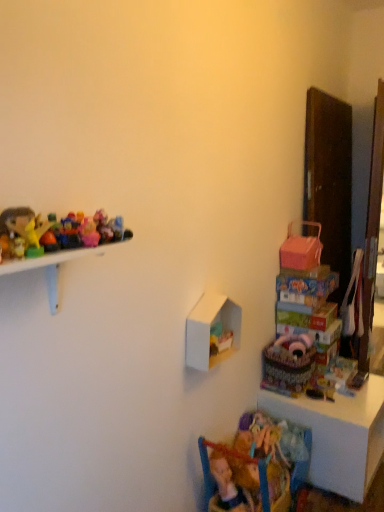
Question: From the image's perspective, is translucent plastic toys at upper left, which is counted as the 2th toy, starting from the front, over white matte shelf at center?

Choices:
 (A) no
 (B) yes

Answer: (B)

Question: Is translucent plastic toys at upper left, the second toy from the left, to the right of white matte shelf at center from the viewer's perspective?

Choices:
 (A) yes
 (B) no

Answer: (B)

Question: Considering the relative sizes of translucent plastic toys at upper left, acting as the 3th toy starting from the right, and white matte shelf at center in the image provided, is translucent plastic toys at upper left, acting as the 3th toy starting from the right, shorter than white matte shelf at center?

Choices:
 (A) no
 (B) yes

Answer: (B)

Question: From a real-world perspective, is translucent plastic toys at upper left, which is counted as the 3th toy, starting from the top, on white matte shelf at center?

Choices:
 (A) yes
 (B) no

Answer: (A)

Question: Is translucent plastic toys at upper left, which is counted as the 2th toy, starting from the front, closer to the viewer compared to white matte shelf at center?

Choices:
 (A) no
 (B) yes

Answer: (B)

Question: Is point (84, 218) closer or farther from the camera than point (306, 345)?

Choices:
 (A) farther
 (B) closer

Answer: (B)

Question: Would you say pink plastic doll at upper left, positioned as the third toy in left-to-right order, is to the left or to the right of pink fabric stuffed animal at lower right, marked as the first toy in a bottom-to-top arrangement, in the picture?

Choices:
 (A) right
 (B) left

Answer: (B)

Question: Is pink plastic doll at upper left, acting as the 4th toy starting from the bottom, wider or thinner than pink fabric stuffed animal at lower right, the first toy in the right-to-left sequence?

Choices:
 (A) wide
 (B) thin

Answer: (B)

Question: From the image's perspective, is pink plastic doll at upper left, placed as the second toy when sorted from back to front, positioned above or below pink fabric stuffed animal at lower right, placed as the fourth toy when sorted from top to bottom?

Choices:
 (A) above
 (B) below

Answer: (A)

Question: Based on their sizes in the image, would you say shiny plastic toys at left, which is the 2th toy from top to bottom, is bigger or smaller than textured fabric basket at lower right?

Choices:
 (A) small
 (B) big

Answer: (A)

Question: Relative to textured fabric basket at lower right, is shiny plastic toys at left, which ranks as the 4th toy in right-to-left order, in front or behind?

Choices:
 (A) front
 (B) behind

Answer: (A)

Question: Is shiny plastic toys at left, which ranks as the 1th toy in left-to-right order, taller or shorter than textured fabric basket at lower right?

Choices:
 (A) tall
 (B) short

Answer: (B)

Question: From a real-world perspective, is shiny plastic toys at left, which ranks as the 1th toy in left-to-right order, physically located above or below textured fabric basket at lower right?

Choices:
 (A) below
 (B) above

Answer: (B)

Question: Is point (82, 224) positioned closer to the camera than point (77, 236)?

Choices:
 (A) farther
 (B) closer

Answer: (A)

Question: Is pink plastic doll at upper left, arranged as the 1th toy when viewed from the top, taller or shorter than translucent plastic toys at upper left, acting as the 3th toy starting from the right?

Choices:
 (A) short
 (B) tall

Answer: (A)